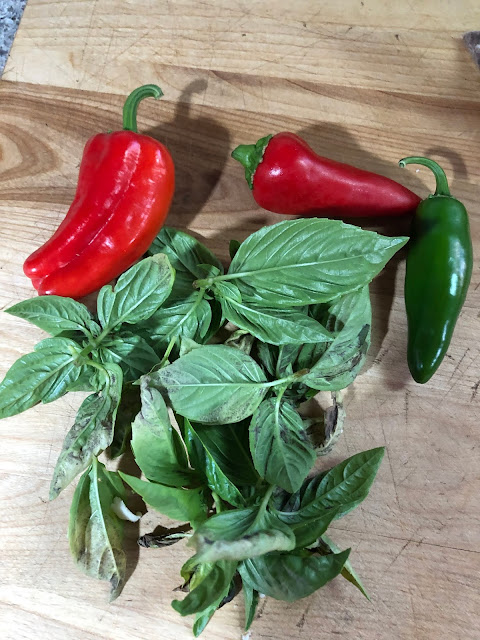
In order to click on cutting board in this screenshot , I will do `click(405, 514)`.